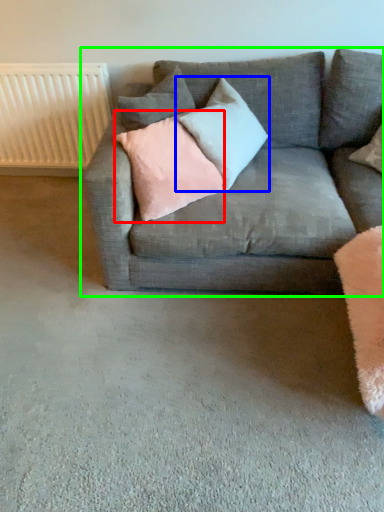
Question: Which object is the farthest from pillow (highlighted by a red box)? Choose among these: pillow (highlighted by a blue box) or studio couch (highlighted by a green box).

Choices:
 (A) pillow
 (B) studio couch

Answer: (B)